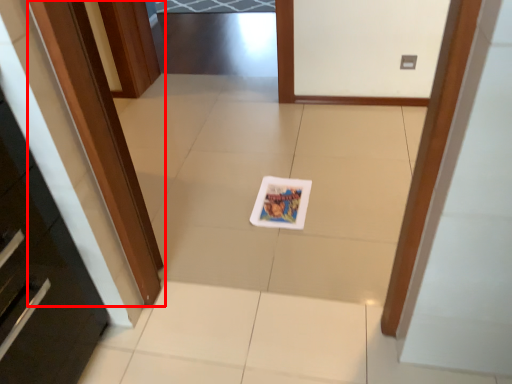
Question: From the image's perspective, where is door (annotated by the red box) located in relation to postcard in the image?

Choices:
 (A) below
 (B) above

Answer: (B)